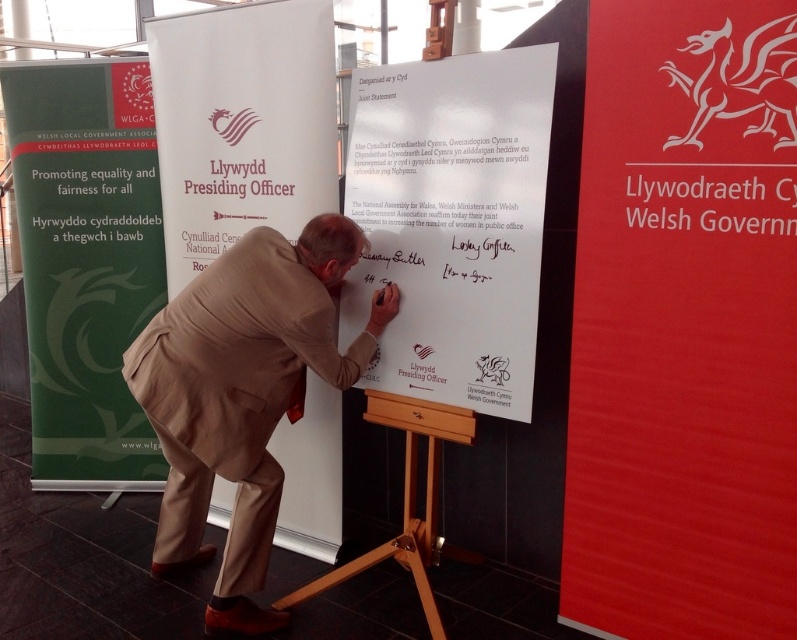
Can you confirm if white paperboard at center is positioned to the right of wooden at center?

Indeed, white paperboard at center is positioned on the right side of wooden at center.

Is white paperboard at center closer to camera compared to wooden at center?

Yes, it is in front of wooden at center.

Where is `white paperboard at center`? The width and height of the screenshot is (797, 640). white paperboard at center is located at coordinates (450, 221).

The image size is (797, 640). What are the coordinates of `white paperboard at center` in the screenshot? It's located at (450, 221).

Between white paperboard at center and beige fabric suit at center, which one has more height?

beige fabric suit at center is taller.

Can you confirm if white paperboard at center is positioned below beige fabric suit at center?

Actually, white paperboard at center is above beige fabric suit at center.

Find the location of `white paperboard at center`. white paperboard at center is located at coordinates (450, 221).

The width and height of the screenshot is (797, 640). I want to click on white paperboard at center, so click(450, 221).

Does green fabric banner at left appear over wooden at center?

Yes.

Based on the photo, who is shorter, green fabric banner at left or wooden at center?

wooden at center

Who is more forward, (65, 301) or (367, 561)?

Point (367, 561)

The width and height of the screenshot is (797, 640). In order to click on green fabric banner at left in this screenshot , I will do `click(85, 262)`.